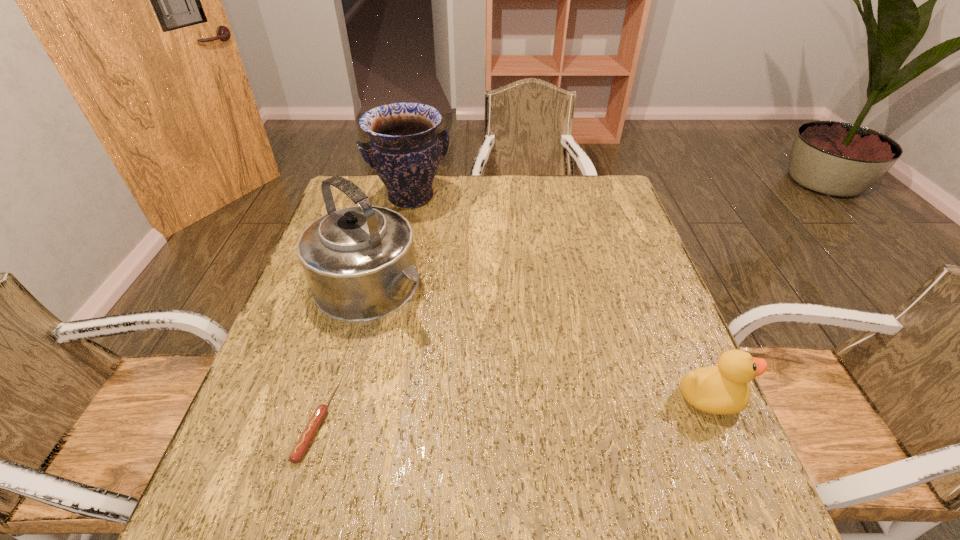
This screenshot has width=960, height=540. Find the location of `the shortest object`. the shortest object is located at coordinates click(x=310, y=430).

Where is `duck`? duck is located at coordinates (723, 389).

Locate an element on the screen. This screenshot has width=960, height=540. the third tallest object is located at coordinates (723, 389).

In order to click on the farthest object in this screenshot , I will do `click(404, 150)`.

Where is `kettle`? kettle is located at coordinates (359, 261).

The image size is (960, 540). Identify the location of vacant space positioned 0.110m on the back of the shortest object. (340, 342).

I want to click on free space located on the front handle of the pottery, so click(434, 238).

Where is `vacant space located 0.300m on the front handle of the pottery`? This screenshot has height=540, width=960. vacant space located 0.300m on the front handle of the pottery is located at coordinates (457, 279).

Identify the location of vacant space located on the front handle of the pottery. The image size is (960, 540). (450, 267).

This screenshot has width=960, height=540. Find the location of `free space located 0.270m with the spout at the front of the second farthest object`. free space located 0.270m with the spout at the front of the second farthest object is located at coordinates (494, 377).